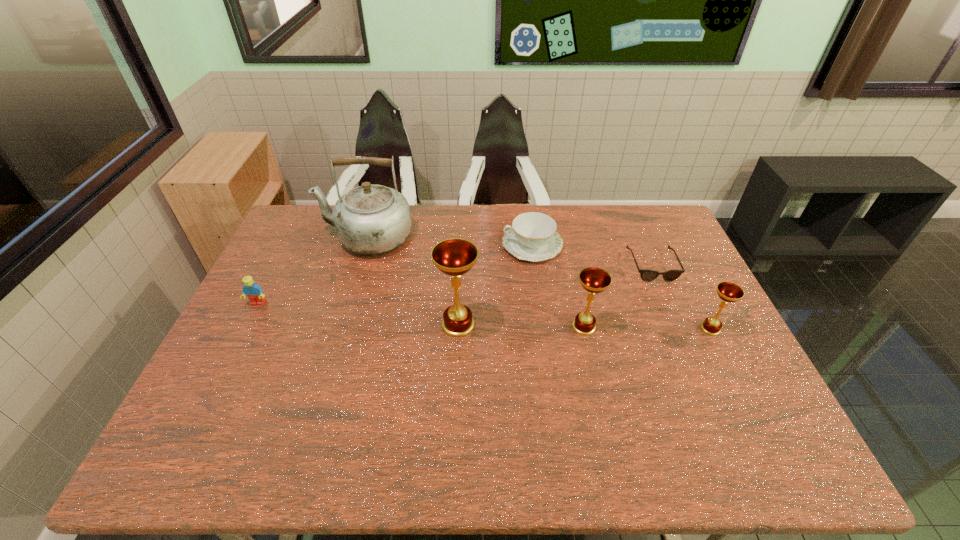
At what (x,y) coordinates should I click in order to perform the action: click on the leftmost object. Please return your answer as a coordinate pair (x, y). Looking at the image, I should click on (251, 290).

The height and width of the screenshot is (540, 960). Identify the location of vacant space located 0.130m on the left of the leftmost chalice. (392, 325).

This screenshot has width=960, height=540. I want to click on free space located 0.060m on the left of the second chalice from right to left, so click(x=548, y=327).

Find the location of a particular element. Image resolution: width=960 pixels, height=540 pixels. vacant space located 0.070m on the left of the fourth shortest object is located at coordinates (674, 328).

Find the location of a particular element. Image resolution: width=960 pixels, height=540 pixels. vacant space situated 0.180m on the handle side of the sixth tallest object is located at coordinates pyautogui.click(x=448, y=245).

What are the coordinates of `vacant space located 0.130m on the handle side of the sixth tallest object` in the screenshot? It's located at click(x=464, y=245).

This screenshot has width=960, height=540. Identify the location of free location located 0.350m on the handle side of the sixth tallest object. (398, 245).

Where is `vacant area located 0.060m at the spout of the second object from left to right`? The image size is (960, 540). vacant area located 0.060m at the spout of the second object from left to right is located at coordinates (305, 237).

Image resolution: width=960 pixels, height=540 pixels. In order to click on free location located 0.090m at the spout of the second object from left to right in this screenshot , I will do `click(296, 237)`.

Locate an element on the screen. The width and height of the screenshot is (960, 540). vacant area situated on the front lenses of the sunglasses is located at coordinates [679, 329].